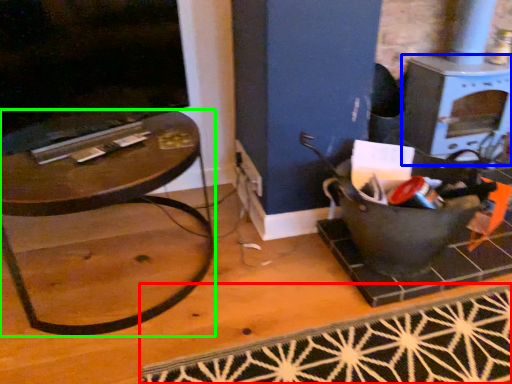
Question: Based on their relative distances, which object is nearer to doormat (highlighted by a red box)? Choose from stove (highlighted by a blue box) and table (highlighted by a green box).

Choices:
 (A) stove
 (B) table

Answer: (B)